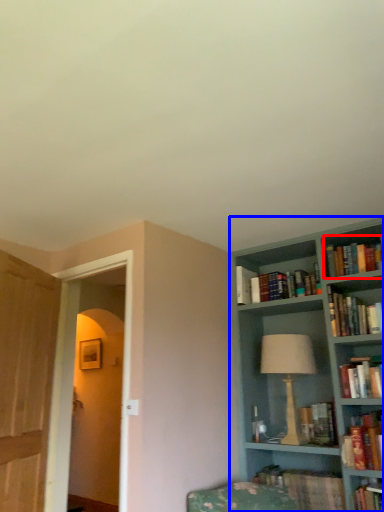
Question: Which of the following is the farthest to the observer, book (highlighted by a red box) or bookcase (highlighted by a blue box)?

Choices:
 (A) book
 (B) bookcase

Answer: (A)